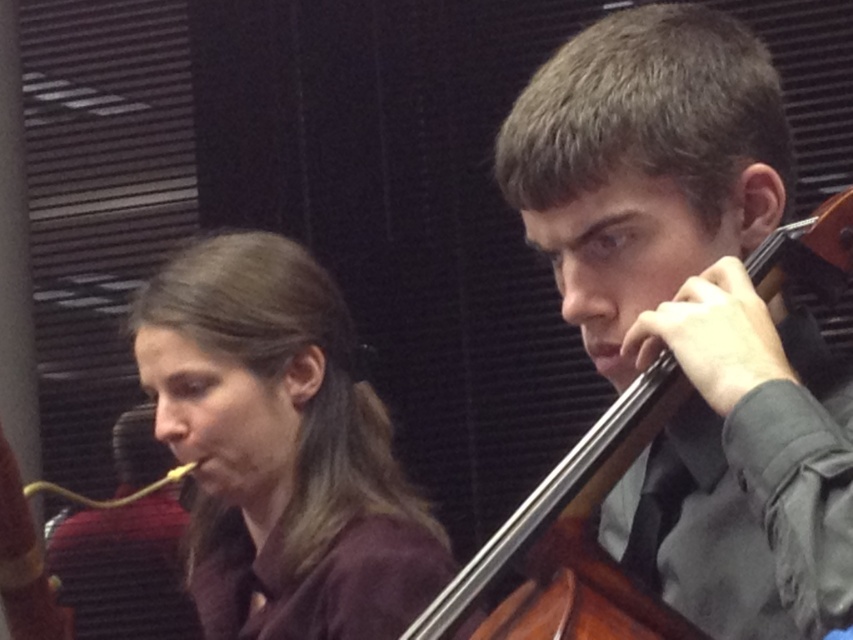
You are a photographer setting up for a group photo of the two musicians. You need to ensure that the brown matte hair at center and the brown wooden cello at center are both visible in the frame. Which object should you position closer to the camera to avoid blocking the other?

The brown wooden cello at center should be positioned closer to the camera because the brown matte hair at center is taller than it. This way, the shorter cello won

You are a photographer setting up for a group photo. You need to position a light source between the brown matte hair at center and the brown wooden cello at center. Based on their widths, which object should the light be placed closer to?

The light should be placed closer to the brown wooden cello at center because the brown matte hair at center might be wider, so the cello is narrower and requires less light coverage.

You are a photographer setting up for a concert photo shoot. You have two points marked on your camera screen at coordinates point (303,588) and point (838,259). Which point is closer to the camera lens?

Point (303,588) is further to the camera than point (838,259). Wait, the question asks which is closer. The description says point (303,588) is further than the other, so the closer one is point (838,259).